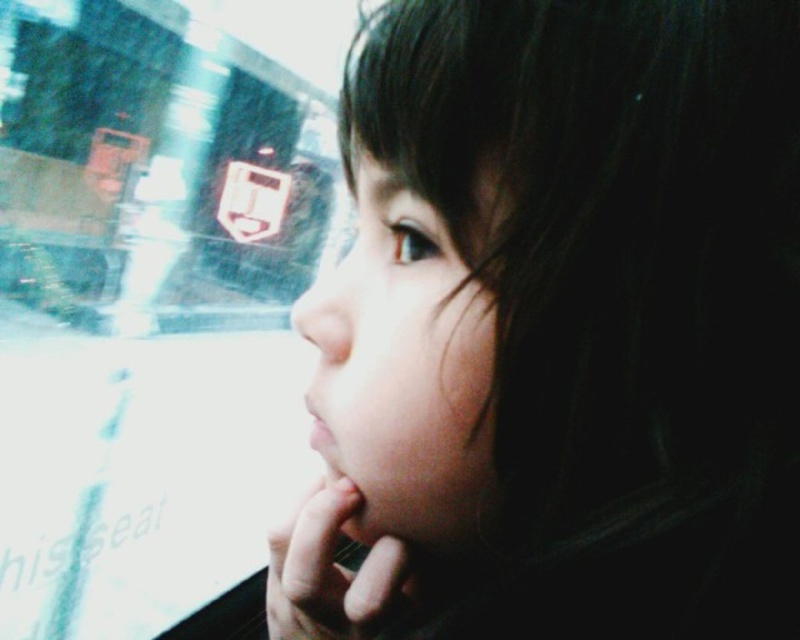
Can you confirm if dark hair at upper right is wider than transparent glass train window at upper left?

Incorrect, dark hair at upper right's width does not surpass transparent glass train window at upper left's.

Is dark hair at upper right bigger than transparent glass train window at upper left?

No.

Identify the location of dark hair at upper right. (558, 330).